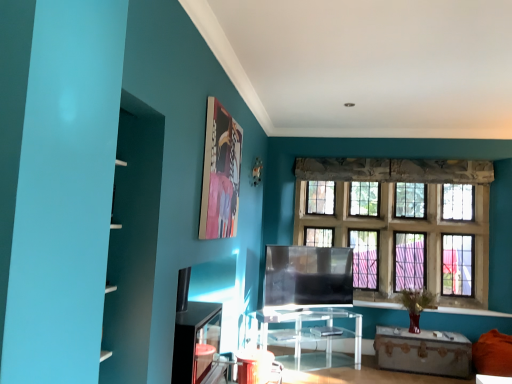
Question: From the image's perspective, is clear glass windows at center above or below matte blue bookshelf at left?

Choices:
 (A) above
 (B) below

Answer: (B)

Question: Considering the positions of clear glass windows at center and matte blue bookshelf at left in the image, is clear glass windows at center taller or shorter than matte blue bookshelf at left?

Choices:
 (A) short
 (B) tall

Answer: (B)

Question: Estimate the real-world distances between objects in this image. Which object is farther from the matte plastic picture frame at upper center?

Choices:
 (A) transparent acrylic table at center, the 2th table in the right-to-left sequence
 (B) clear glass windows at center
 (C) orange fabric couch at lower right
 (D) rustic wooden trunk at lower right, the second table when ordered from left to right
 (E) transparent glass tv at center

Answer: (C)

Question: Which object is the farthest from the transparent acrylic table at center, the 2th table in the right-to-left sequence?

Choices:
 (A) orange fabric couch at lower right
 (B) rustic wooden trunk at lower right, marked as the 1th table in a right-to-left arrangement
 (C) matte blue bookshelf at left
 (D) matte plastic picture frame at upper center
 (E) clear glass windows at center

Answer: (C)